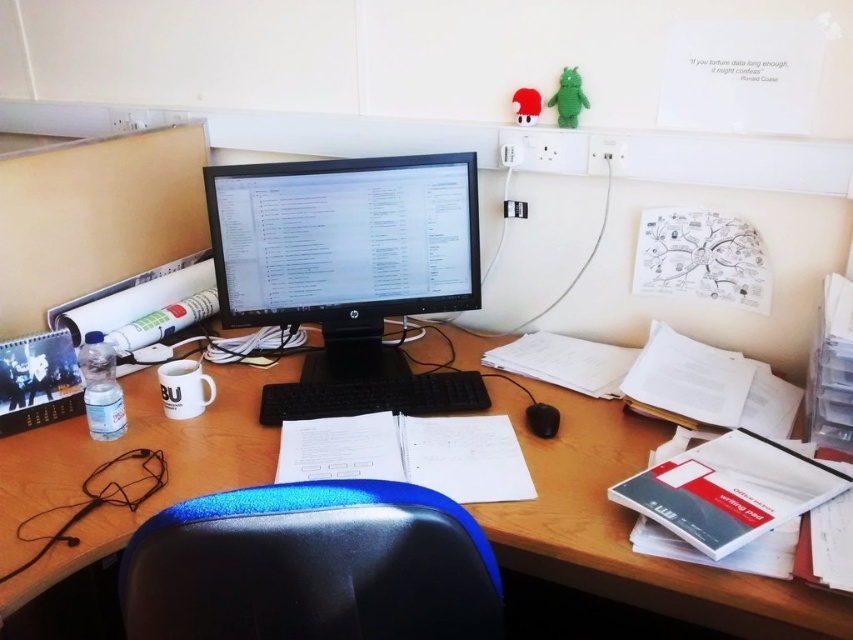
You are organizing your desk and want to place a new item between the wooden at center and the black plastic keyboard at center. Based on their positions, which object should the new item be closer to?

The wooden at center is in front of the black plastic keyboard at center, so the new item should be placed closer to the black plastic keyboard at center to maintain the existing spatial arrangement.

You are organizing your desk and need to place a new item between the black glossy monitor at center and the black plastic keyboard at center. Given their sizes, which object should you place closer to the edge of the desk to save space?

Since the black glossy monitor at center is larger than the black plastic keyboard at center, you should place the black plastic keyboard at center closer to the edge of the desk to save space.